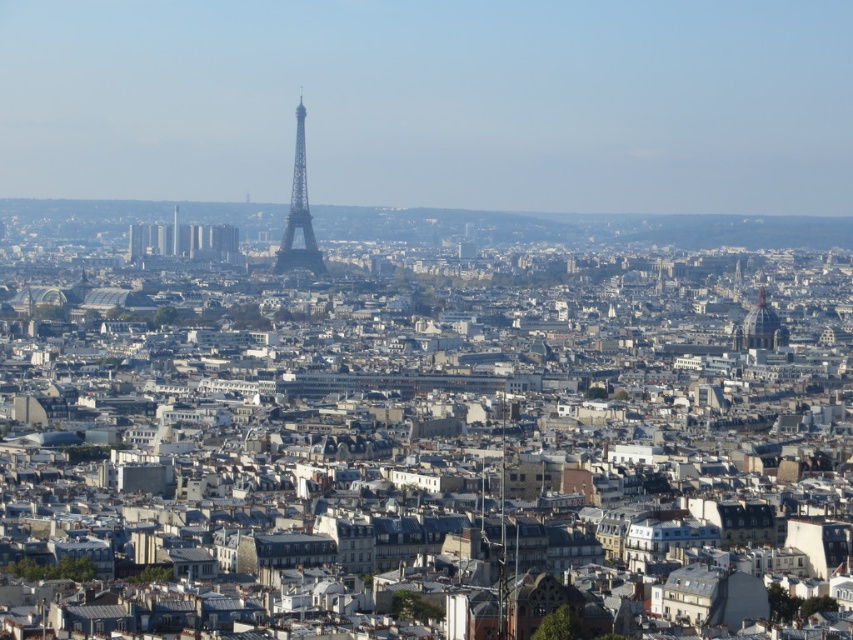
Can you confirm if metallic silver eiffel tower at center is bigger than matte gold dome at center-right?

No, metallic silver eiffel tower at center is not bigger than matte gold dome at center-right.

What do you see at coordinates (299, 212) in the screenshot? I see `metallic silver eiffel tower at center` at bounding box center [299, 212].

Where is `metallic silver eiffel tower at center`? The width and height of the screenshot is (853, 640). metallic silver eiffel tower at center is located at coordinates (299, 212).